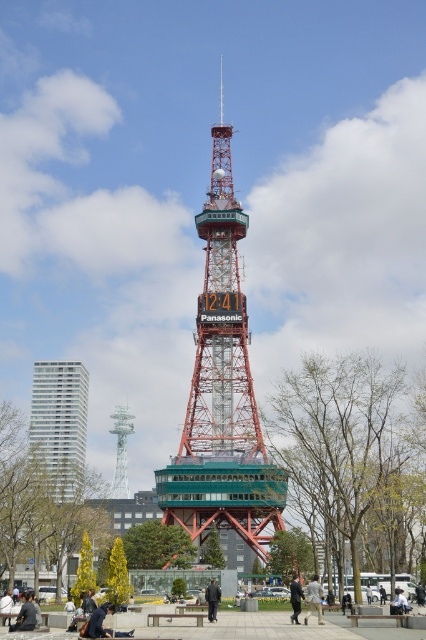
At what (x,y) coordinates should I click in order to perform the action: click on white glass building at left. Please return your answer as a coordinate pair (x, y). The width and height of the screenshot is (426, 640). Looking at the image, I should click on (60, 429).

Does white glass building at left have a larger size compared to dark blue fabric jacket at lower left?

Correct, white glass building at left is larger in size than dark blue fabric jacket at lower left.

Is point (40, 404) positioned after point (92, 620)?

Yes, it is behind point (92, 620).

This screenshot has height=640, width=426. Identify the location of white glass building at left. (60, 429).

Does dark blue jeans at lower left appear on the left side of dark gray fabric jacket at lower center?

Correct, you'll find dark blue jeans at lower left to the left of dark gray fabric jacket at lower center.

In the scene shown: Does dark blue jeans at lower left have a lesser width compared to dark gray fabric jacket at lower center?

Incorrect, dark blue jeans at lower left's width is not less than dark gray fabric jacket at lower center's.

Between point (23, 593) and point (291, 584), which one is positioned behind?

Positioned behind is point (23, 593).

Identify the location of dark blue jeans at lower left. (25, 614).

Which is in front, point (236, 518) or point (97, 609)?

Positioned in front is point (97, 609).

The height and width of the screenshot is (640, 426). Identify the location of orange metallic eiffel tower at center. (222, 385).